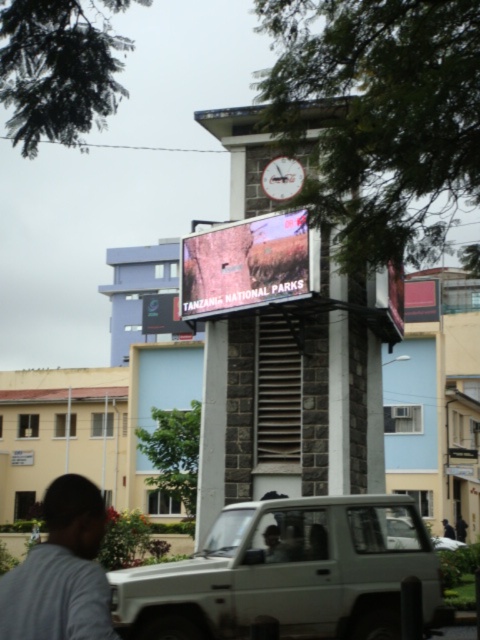
Identify the location of black glossy sign at center. (164, 316).

Does black glossy sign at center have a lesser height compared to silver metallic suv at center?

Yes, black glossy sign at center is shorter than silver metallic suv at center.

Is point (152, 307) closer to viewer compared to point (394, 532)?

No, (152, 307) is behind (394, 532).

Identify the location of black glossy sign at center. (164, 316).

Does matte white suv at center have a greater height compared to gray matte shirt at lower left?

Indeed, matte white suv at center has a greater height compared to gray matte shirt at lower left.

Between matte white suv at center and gray matte shirt at lower left, which one has less height?

gray matte shirt at lower left is shorter.

What do you see at coordinates (285, 573) in the screenshot? I see `matte white suv at center` at bounding box center [285, 573].

Find the location of a particular element. This screenshot has width=480, height=640. matte white suv at center is located at coordinates (285, 573).

Based on the photo, does matte white suv at center appear on the right side of silver metallic suv at center?

No, matte white suv at center is not to the right of silver metallic suv at center.

Which is below, matte white suv at center or silver metallic suv at center?

Positioned lower is silver metallic suv at center.

Who is more distant from viewer, (358, 509) or (392, 525)?

Point (392, 525)

Find the location of a particular element. The image size is (480, 640). matte white suv at center is located at coordinates (285, 573).